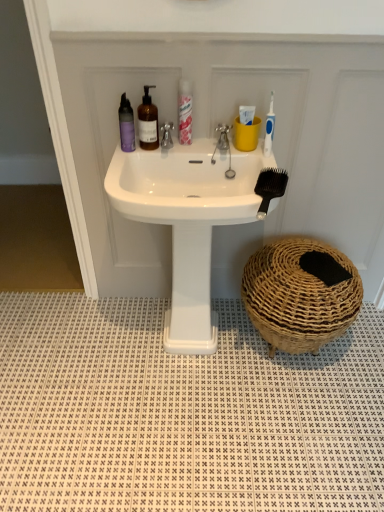
Find the location of a particular element. The width and height of the screenshot is (384, 512). free spot in front of brown woven basket at lower right is located at coordinates (297, 421).